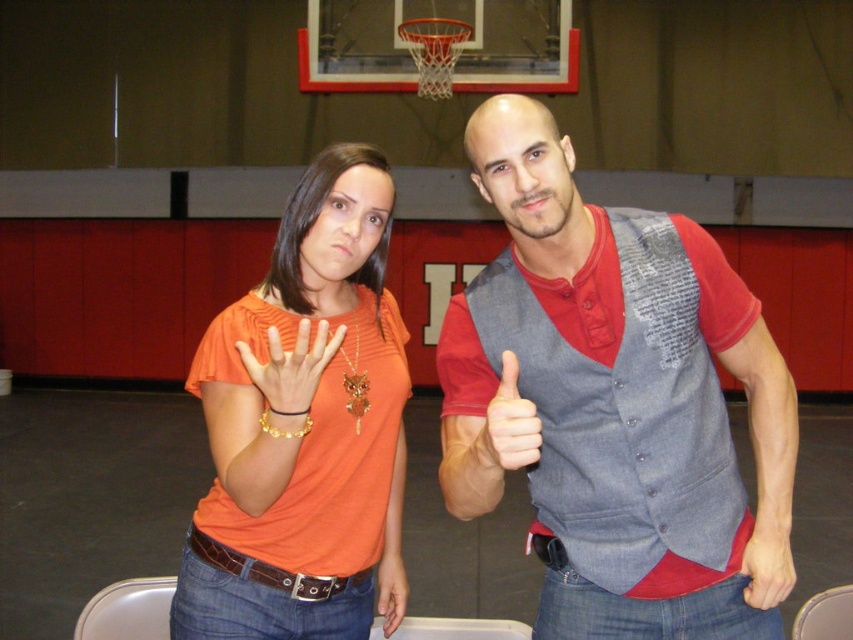
Question: Which point is closer to the camera?

Choices:
 (A) (366, 404)
 (B) (386, 557)

Answer: (A)

Question: Does denim vest at center appear under matte gray hand at lower right?

Choices:
 (A) no
 (B) yes

Answer: (A)

Question: Is gold metallic bracelet at center below matte orange shirt at center?

Choices:
 (A) yes
 (B) no

Answer: (B)

Question: Which point is farther from the camera taking this photo?

Choices:
 (A) (763, 493)
 (B) (206, 621)
 (C) (393, 584)
 (D) (515, 387)

Answer: (C)

Question: Is orange fabric shirt at left smaller than gold metallic bracelet at center?

Choices:
 (A) no
 (B) yes

Answer: (A)

Question: Which object is the farthest from the matte orange shirt at center?

Choices:
 (A) gold metallic bracelet at center
 (B) matte gray hand at center

Answer: (A)